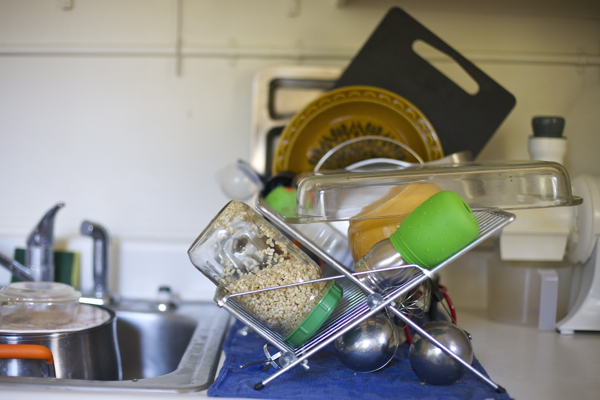
Image resolution: width=600 pixels, height=400 pixels. I want to click on bowl, so click(x=414, y=124).